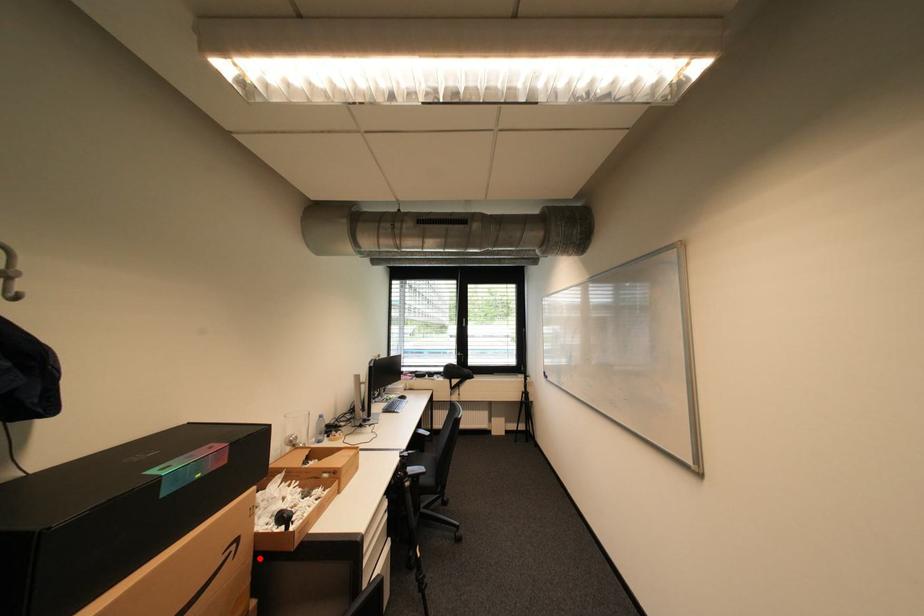
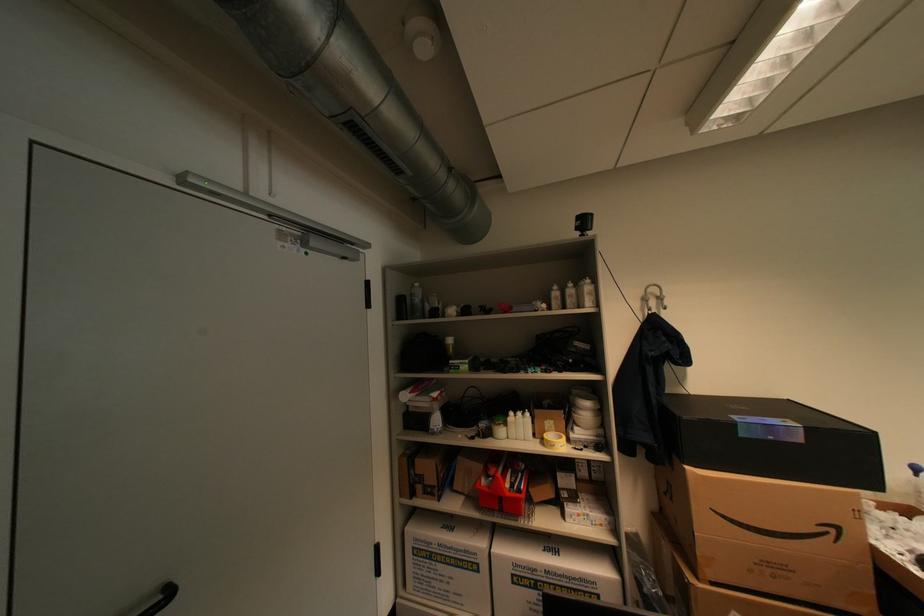
Find the pixel in the second image that matches the highlighted location in the first image.

(879, 568)